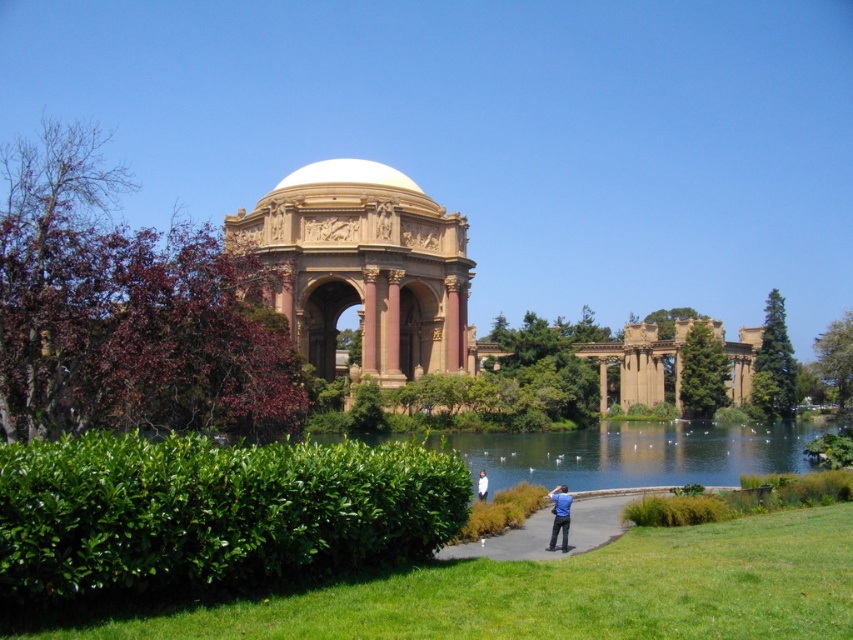
You are a tourist standing in front of the Palace of Fine Arts. You see the green grass at center and the blue shirt at center. Which object is closer to the ground?

The green grass at center is located below the blue shirt at center, so it is closer to the ground.

You are a landscape architect designing a garden layout. You have two green leafy bushes to place in the garden. The green leafy bush at left and the green leafy bush at center. Which bush should you choose if you want a larger bush for a focal point?

The green leafy bush at left is bigger than the green leafy bush at center, so you should choose the green leafy bush at left for the focal point.